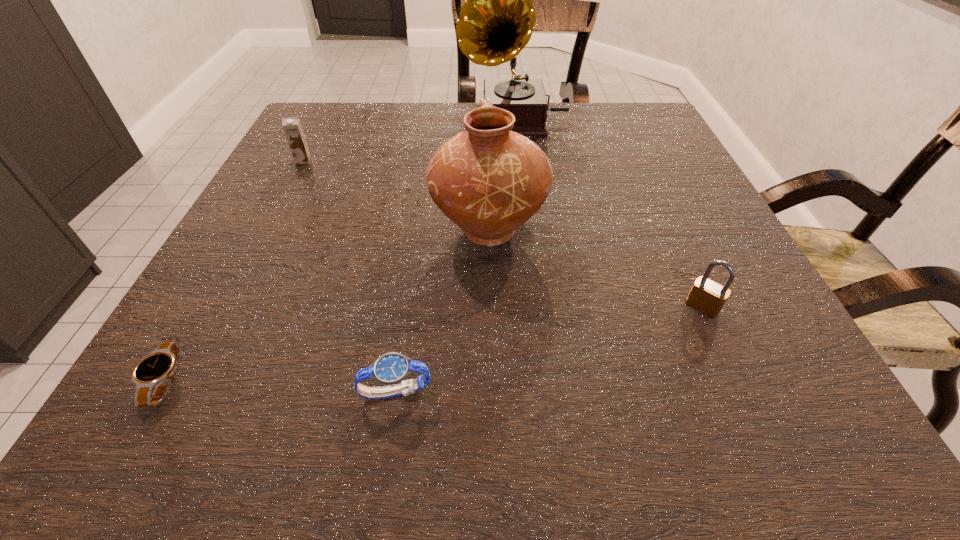
At what (x,y) coordinates should I click in order to perform the action: click on vacant space located on the back of the left watch. Please return your answer as a coordinate pair (x, y). Image resolution: width=960 pixels, height=540 pixels. Looking at the image, I should click on (225, 275).

You are a GUI agent. You are given a task and a screenshot of the screen. Output one action in this format:
    pyautogui.click(x=<x>, y=<y>)
    Task: Click on the object that is at the far edge
    This screenshot has width=960, height=540.
    Given the screenshot: What is the action you would take?
    pyautogui.click(x=496, y=22)

The image size is (960, 540). In order to click on chocolate milk that is at the left edge in this screenshot , I will do `click(292, 127)`.

This screenshot has height=540, width=960. Identify the location of watch that is at the left edge. (156, 370).

This screenshot has width=960, height=540. What are the coordinates of `object that is at the right edge` in the screenshot? It's located at (708, 297).

Where is `object that is positioned at the near left corner`? object that is positioned at the near left corner is located at coordinates (156, 370).

Locate an element on the screen. The image size is (960, 540). vacant space at the far edge is located at coordinates (580, 144).

Identify the location of vacant position at the near edge of the desktop. This screenshot has height=540, width=960. (675, 416).

Locate an element on the screen. Image resolution: width=960 pixels, height=540 pixels. vacant region at the left edge is located at coordinates (284, 161).

In the image, there is a desktop. At what (x,y) coordinates should I click in order to perform the action: click on blank space at the right edge. Please return your answer as a coordinate pair (x, y). Looking at the image, I should click on (732, 309).